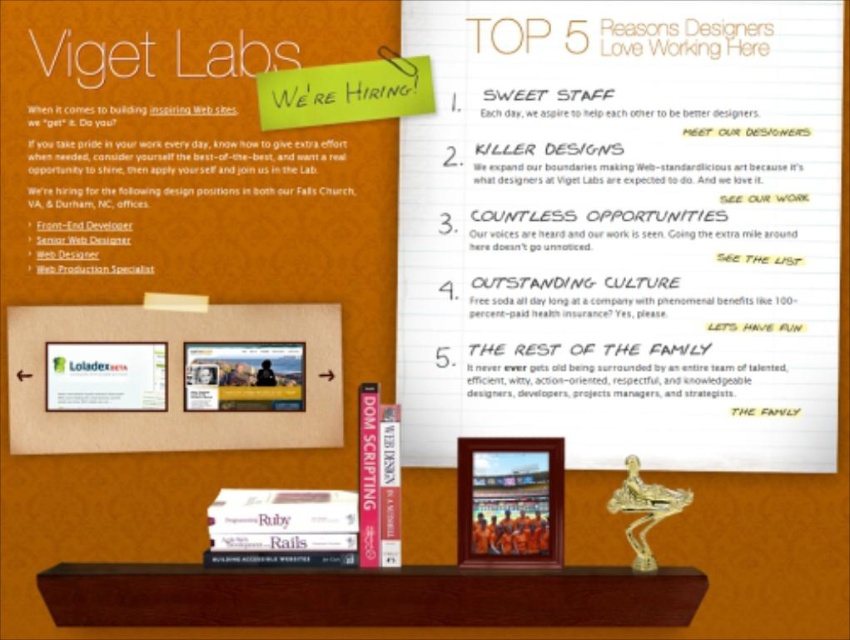
Question: Is white paper flyer at upper center thinner than matte plastic flyer at center?

Choices:
 (A) yes
 (B) no

Answer: (B)

Question: Can you confirm if white paper flyer at upper center is positioned below matte plastic flyer at center?

Choices:
 (A) no
 (B) yes

Answer: (A)

Question: Among these objects, which one is nearest to the camera?

Choices:
 (A) matte plastic flyer at center
 (B) white paper flyer at upper center

Answer: (B)

Question: Can you confirm if white paper flyer at upper center is smaller than matte plastic flyer at center?

Choices:
 (A) no
 (B) yes

Answer: (A)

Question: Which of the following is the farthest from the observer?

Choices:
 (A) (38, 452)
 (B) (496, 80)

Answer: (B)